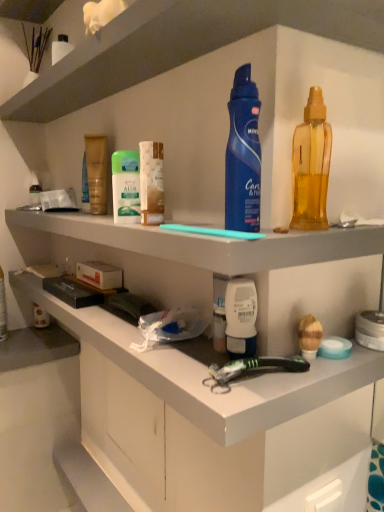
Question: Is white matte cabinet at lower center, which is the 3th shelf in top-to-bottom order, positioned behind translucent yellow liquid at right, acting as the second cleaning product starting from the left?

Choices:
 (A) no
 (B) yes

Answer: (A)

Question: From the image's perspective, does white matte cabinet at lower center, which is the 3th shelf in top-to-bottom order, appear higher than translucent yellow liquid at right, which is the first cleaning product in right-to-left order?

Choices:
 (A) yes
 (B) no

Answer: (B)

Question: Is the depth of white matte cabinet at lower center, which is the 3th shelf in top-to-bottom order, less than that of translucent yellow liquid at right, acting as the second cleaning product starting from the left?

Choices:
 (A) no
 (B) yes

Answer: (B)

Question: Could translucent yellow liquid at right, acting as the second cleaning product starting from the left, be considered to be inside white matte cabinet at lower center, marked as the 1th shelf in a bottom-to-top arrangement?

Choices:
 (A) no
 (B) yes

Answer: (A)

Question: Is white matte cabinet at lower center, which is the 3th shelf in top-to-bottom order, positioned with its back to translucent yellow liquid at right, which is the first cleaning product in right-to-left order?

Choices:
 (A) yes
 (B) no

Answer: (B)

Question: Visually, is blue matte deodorant at center, acting as the 2th cleaning product starting from the right, positioned to the left or to the right of translucent yellow liquid at right, acting as the second cleaning product starting from the left?

Choices:
 (A) left
 (B) right

Answer: (A)

Question: From a real-world perspective, is blue matte deodorant at center, which ranks as the first cleaning product in left-to-right order, positioned above or below translucent yellow liquid at right, acting as the second cleaning product starting from the left?

Choices:
 (A) above
 (B) below

Answer: (A)

Question: From the image's perspective, is blue matte deodorant at center, which ranks as the first cleaning product in left-to-right order, positioned above or below translucent yellow liquid at right, which is the first cleaning product in right-to-left order?

Choices:
 (A) below
 (B) above

Answer: (B)

Question: Does point [258, 167] appear closer or farther from the camera than point [322, 170]?

Choices:
 (A) closer
 (B) farther

Answer: (A)

Question: From their relative heights in the image, would you say white plastic shelf at upper center, which is the 1th shelf from top to bottom, is taller or shorter than white matte drawer at lower center?

Choices:
 (A) tall
 (B) short

Answer: (B)

Question: In terms of size, does white plastic shelf at upper center, which is the 1th shelf from top to bottom, appear bigger or smaller than white matte drawer at lower center?

Choices:
 (A) big
 (B) small

Answer: (A)

Question: From the image's perspective, is white plastic shelf at upper center, which is the 3th shelf in bottom-to-top order, above or below white matte drawer at lower center?

Choices:
 (A) below
 (B) above

Answer: (B)

Question: Is white plastic shelf at upper center, which is the 1th shelf from top to bottom, wider or thinner than white matte drawer at lower center?

Choices:
 (A) thin
 (B) wide

Answer: (B)

Question: From a real-world perspective, relative to black plastic toothbrush at lower center, is white plastic shelf at upper center, which is the 3th shelf in bottom-to-top order, vertically above or below?

Choices:
 (A) above
 (B) below

Answer: (A)

Question: From the image's perspective, relative to black plastic toothbrush at lower center, is white plastic shelf at upper center, which is the 3th shelf in bottom-to-top order, above or below?

Choices:
 (A) below
 (B) above

Answer: (B)